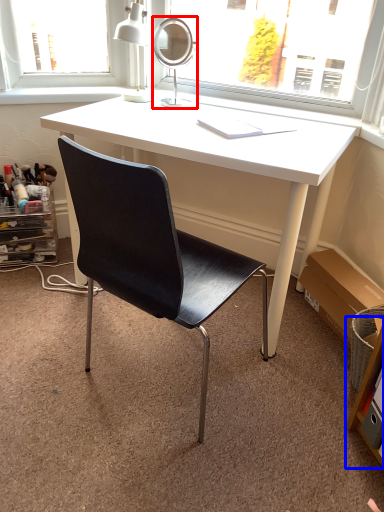
Question: Which object appears closest to the camera in this image, mirror (highlighted by a red box) or shelf (highlighted by a blue box)?

Choices:
 (A) mirror
 (B) shelf

Answer: (B)